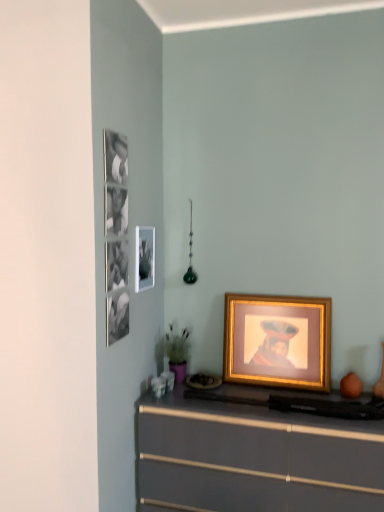
Question: Is metallic silver picture frame at upper left, arranged as the second picture frame when viewed from the right, taller or shorter than gold metallic picture frame at center, which is counted as the second picture frame, starting from the top?

Choices:
 (A) short
 (B) tall

Answer: (A)

Question: From the image's perspective, is metallic silver picture frame at upper left, arranged as the second picture frame when viewed from the right, above or below gold metallic picture frame at center, the 1th picture frame positioned from the bottom?

Choices:
 (A) below
 (B) above

Answer: (B)

Question: Considering the real-world distances, which object is farthest from the matte gray chest of drawers at lower center?

Choices:
 (A) gold metallic picture frame at center, placed as the second picture frame when sorted from left to right
 (B) metallic silver picture frame at upper left, acting as the first picture frame starting from the left

Answer: (B)

Question: Estimate the real-world distances between objects in this image. Which object is farther from the matte gray chest of drawers at lower center?

Choices:
 (A) metallic silver picture frame at upper left, arranged as the first picture frame when viewed from the top
 (B) gold metallic picture frame at center, the first picture frame when ordered from right to left

Answer: (A)